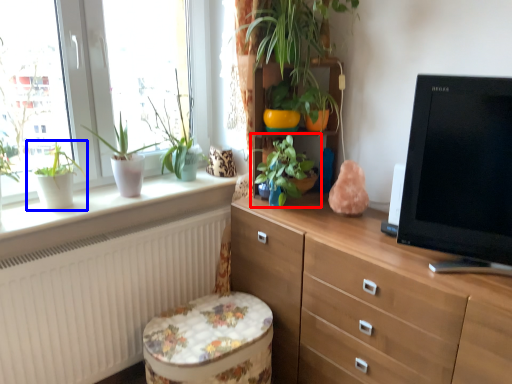
Question: Which object is further to the camera taking this photo, houseplant (highlighted by a red box) or houseplant (highlighted by a blue box)?

Choices:
 (A) houseplant
 (B) houseplant

Answer: (A)